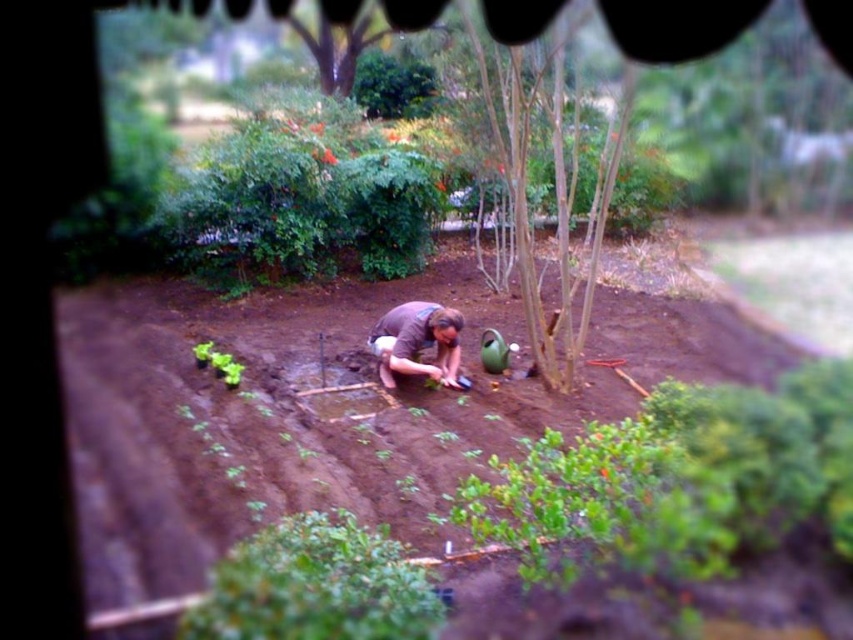
Question: Which point is farther from the camera taking this photo?

Choices:
 (A) (457, 8)
 (B) (453, 380)

Answer: (A)

Question: Is brown bark tree at center above brown cotton shirt at center?

Choices:
 (A) no
 (B) yes

Answer: (B)

Question: In this image, where is brown bark tree at center located relative to brown cotton shirt at center?

Choices:
 (A) above
 (B) below

Answer: (A)

Question: Where is brown bark tree at center located in relation to brown cotton shirt at center in the image?

Choices:
 (A) right
 (B) left

Answer: (A)

Question: Which point appears farthest from the camera in this image?

Choices:
 (A) (393, 360)
 (B) (503, 166)

Answer: (B)